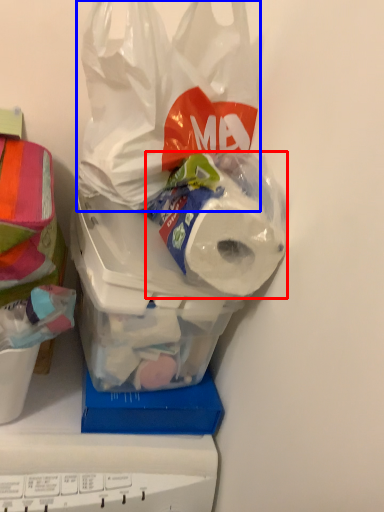
Question: Among these objects, which one is nearest to the camera, toilet paper (highlighted by a red box) or plastic bag (highlighted by a blue box)?

Choices:
 (A) toilet paper
 (B) plastic bag

Answer: (B)